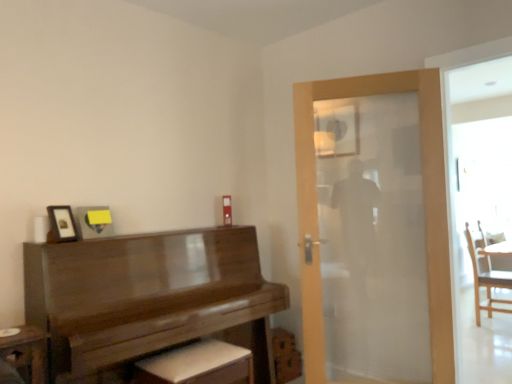
Question: Considering the relative sizes of matte glass mirror at upper center and matte black picture frame at upper left in the image provided, is matte glass mirror at upper center thinner than matte black picture frame at upper left?

Choices:
 (A) yes
 (B) no

Answer: (A)

Question: From the image's perspective, does matte glass mirror at upper center appear higher than matte black picture frame at upper left?

Choices:
 (A) yes
 (B) no

Answer: (A)

Question: Can you confirm if matte glass mirror at upper center is bigger than matte black picture frame at upper left?

Choices:
 (A) yes
 (B) no

Answer: (A)

Question: Is matte glass mirror at upper center turned away from matte black picture frame at upper left?

Choices:
 (A) yes
 (B) no

Answer: (B)

Question: Can matte black picture frame at upper left be found inside matte glass mirror at upper center?

Choices:
 (A) yes
 (B) no

Answer: (B)

Question: Looking at their shapes, would you say matte glass mirror at upper center is wider or thinner than matte black picture frame at upper left?

Choices:
 (A) wide
 (B) thin

Answer: (B)

Question: Visually, is matte glass mirror at upper center positioned to the left or to the right of matte black picture frame at upper left?

Choices:
 (A) right
 (B) left

Answer: (A)

Question: In terms of size, does matte glass mirror at upper center appear bigger or smaller than matte black picture frame at upper left?

Choices:
 (A) small
 (B) big

Answer: (B)

Question: From a real-world perspective, relative to matte black picture frame at upper left, is matte glass mirror at upper center vertically above or below?

Choices:
 (A) below
 (B) above

Answer: (B)

Question: In the image, is white leather footrest at lower center positioned in front of or behind matte glass mirror at upper center?

Choices:
 (A) behind
 (B) front

Answer: (B)

Question: Does point coord(168,370) appear closer or farther from the camera than point coord(332,112)?

Choices:
 (A) farther
 (B) closer

Answer: (B)

Question: Considering the relative positions of white leather footrest at lower center and matte glass mirror at upper center in the image provided, is white leather footrest at lower center to the left or to the right of matte glass mirror at upper center?

Choices:
 (A) right
 (B) left

Answer: (B)

Question: Is white leather footrest at lower center taller or shorter than matte glass mirror at upper center?

Choices:
 (A) short
 (B) tall

Answer: (A)

Question: Is matte glass mirror at upper center wider or thinner than wooden piano at left?

Choices:
 (A) wide
 (B) thin

Answer: (B)

Question: Considering the relative positions of matte glass mirror at upper center and wooden piano at left in the image provided, is matte glass mirror at upper center to the left or to the right of wooden piano at left?

Choices:
 (A) right
 (B) left

Answer: (A)